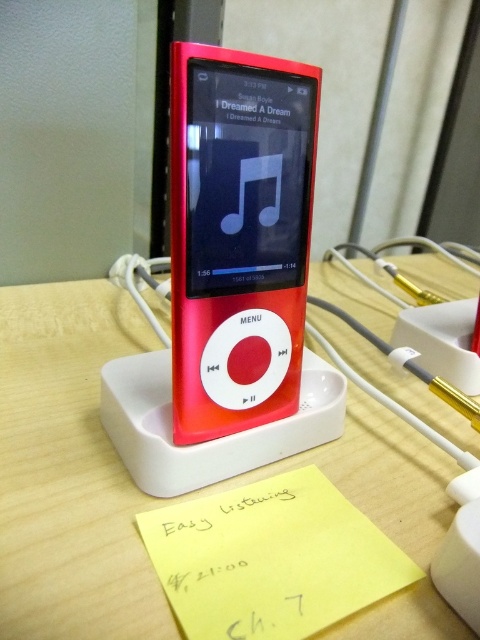
Which is above, matte plastic table at center or matte plastic ipod at center?

Positioned higher is matte plastic ipod at center.

Where is `matte plastic table at center`? matte plastic table at center is located at coordinates (132, 481).

Does point (55, 557) come in front of point (222, 426)?

Yes, it is.

I want to click on matte plastic table at center, so click(132, 481).

Between matte plastic table at center and yellow paper at lower center, which one is positioned higher?

matte plastic table at center is higher up.

Which of these two, matte plastic table at center or yellow paper at lower center, stands taller?

Standing taller between the two is matte plastic table at center.

Is point (113, 538) farther from camera compared to point (188, 548)?

Yes, point (113, 538) is behind point (188, 548).

You are a GUI agent. You are given a task and a screenshot of the screen. Output one action in this format:
    pyautogui.click(x=<x>, y=<y>)
    Task: Click on the matte plastic table at center
    The width and height of the screenshot is (480, 640).
    Given the screenshot: What is the action you would take?
    pyautogui.click(x=132, y=481)

Does point (181, 180) lie in front of point (391, 593)?

No, it is not.

Find the location of a particular element. matte plastic ipod at center is located at coordinates pos(238,236).